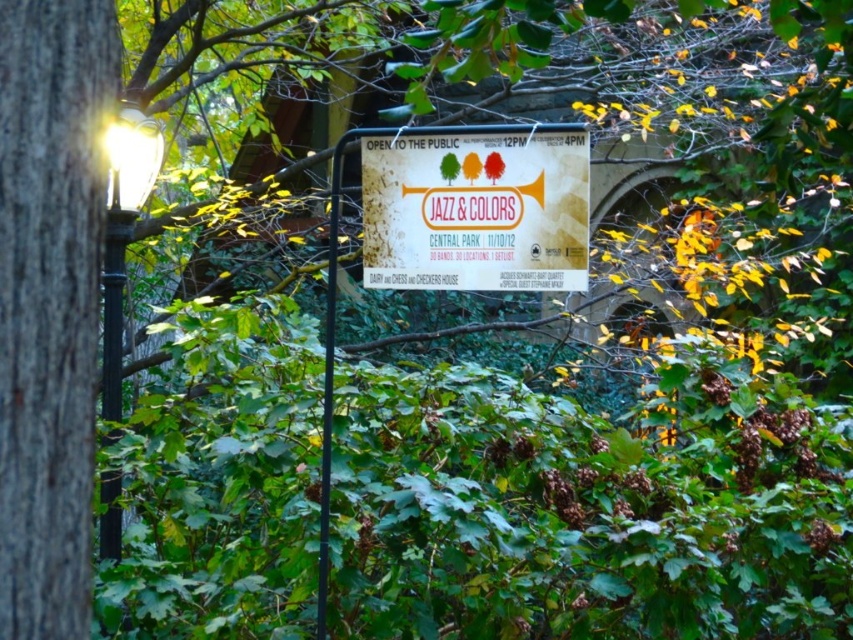
You are a photographer standing in front of the white paper sign at center and the matte black lamp post at left. You want to take a photo where both objects are clearly visible. Which object should you focus on to ensure both are in focus?

You should focus on the matte black lamp post at left because it is further away than the white paper sign at center, so focusing on the lamp post will keep both objects in focus.

Based on the photo, you are standing in the outdoor scene described. There are two points marked in the image. The first point is at coordinate point [398,244] and the second is at point [131,160]. From your perspective, which point is closer to you?

Point [398,244] is in front of point [131,160], so it is closer to you.